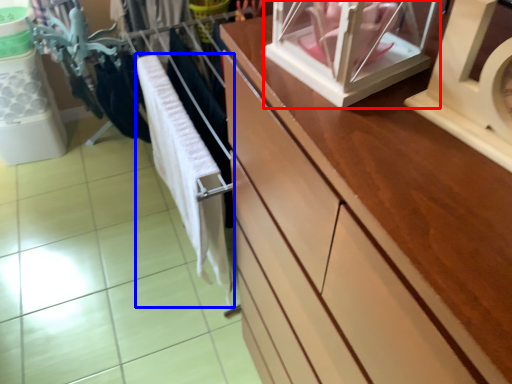
Question: Which object appears farthest to the camera in this image, glass box (highlighted by a red box) or baby clothe (highlighted by a blue box)?

Choices:
 (A) glass box
 (B) baby clothe

Answer: (B)